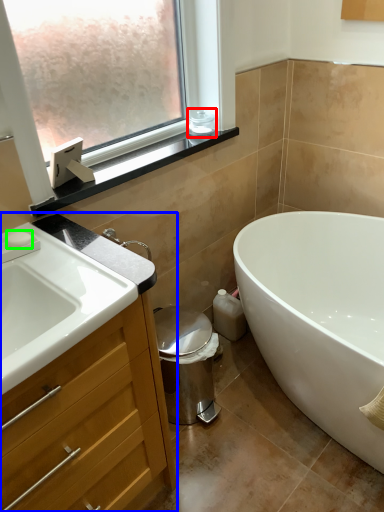
Question: Which object is the farthest from toiletry (highlighted by a red box)? Choose among these: bathroom cabinet (highlighted by a blue box) or soap (highlighted by a green box).

Choices:
 (A) bathroom cabinet
 (B) soap

Answer: (A)